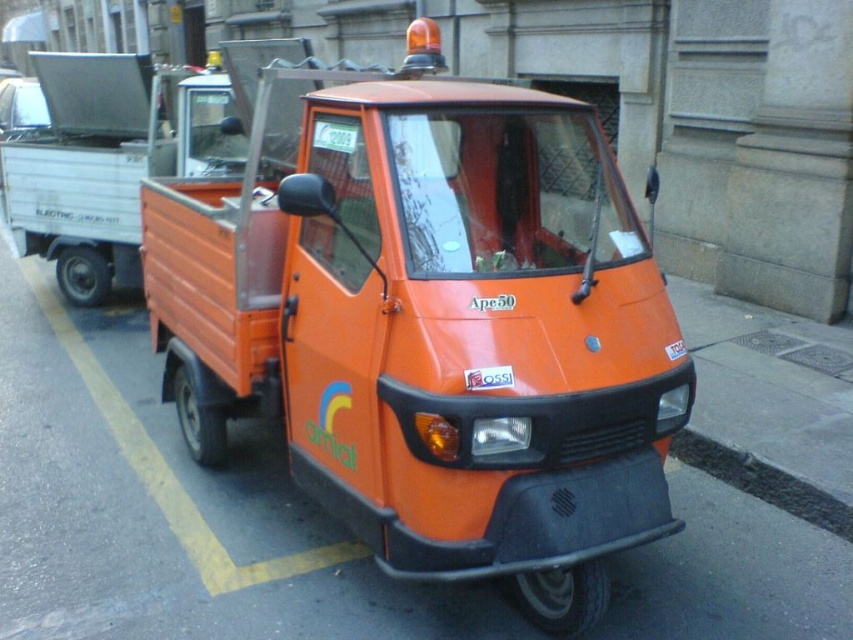
You are standing at the center of the street and see the point marked at coordinates (431,323). What object is located exactly at that point?

The orange matte truck at center is located exactly at point (431,323).

Where is the orange matte truck at center located in the image?

The orange matte truck at center is located at point (x=431, y=323).